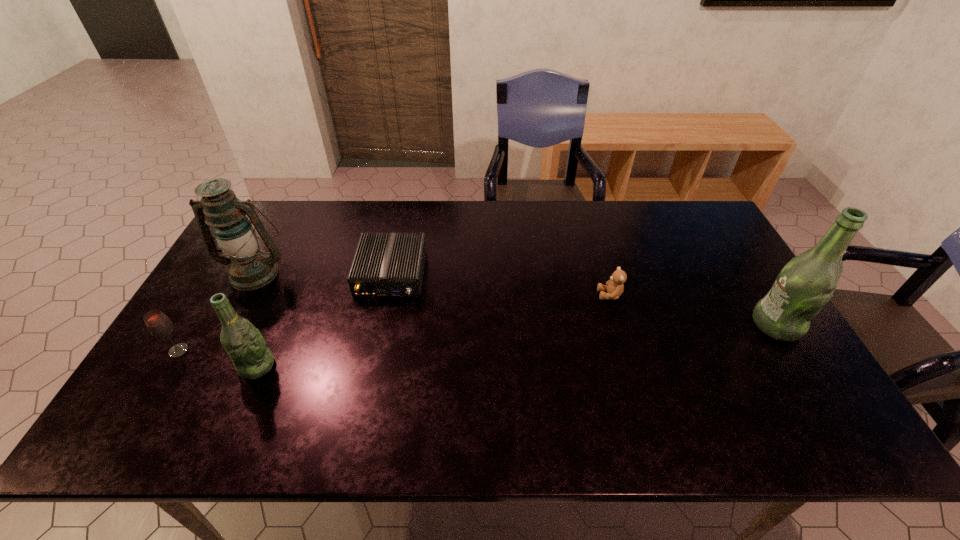
I want to click on object located in the right edge section of the desktop, so (x=806, y=283).

Image resolution: width=960 pixels, height=540 pixels. I want to click on vacant point at the far edge, so click(437, 227).

In the image, there is a desktop. Where is `vacant space at the near edge`? The image size is (960, 540). vacant space at the near edge is located at coordinates (637, 393).

I want to click on vacant space at the left edge of the desktop, so click(217, 293).

The image size is (960, 540). Identify the location of vacant space at the right edge. (697, 271).

In the image, there is a desktop. Where is `vacant space at the far left corner`? This screenshot has width=960, height=540. vacant space at the far left corner is located at coordinates (270, 201).

Identify the location of vacant point at the far right corner. The height and width of the screenshot is (540, 960). (706, 234).

You are a GUI agent. You are given a task and a screenshot of the screen. Output one action in this format:
    pyautogui.click(x=<x>, y=<y>)
    Task: Click on the vacant space at the near right corner of the desktop
    The image size is (960, 540).
    Given the screenshot: What is the action you would take?
    pyautogui.click(x=767, y=373)

Identify the location of vacant area between the teddy bear and the oil lamp. (433, 284).

Identify the location of free spot between the third tallest object and the oil lamp. This screenshot has width=960, height=540. (256, 319).